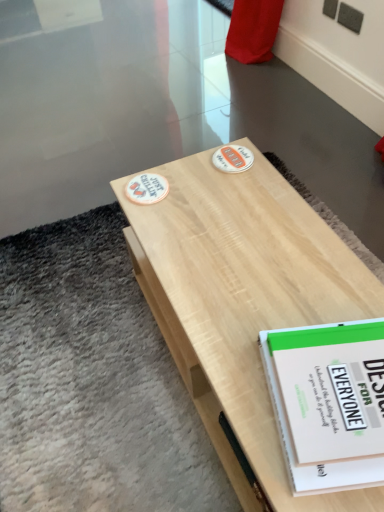
Where is `vacant space situated on the left part of light wood table at center`? vacant space situated on the left part of light wood table at center is located at coordinates (91, 359).